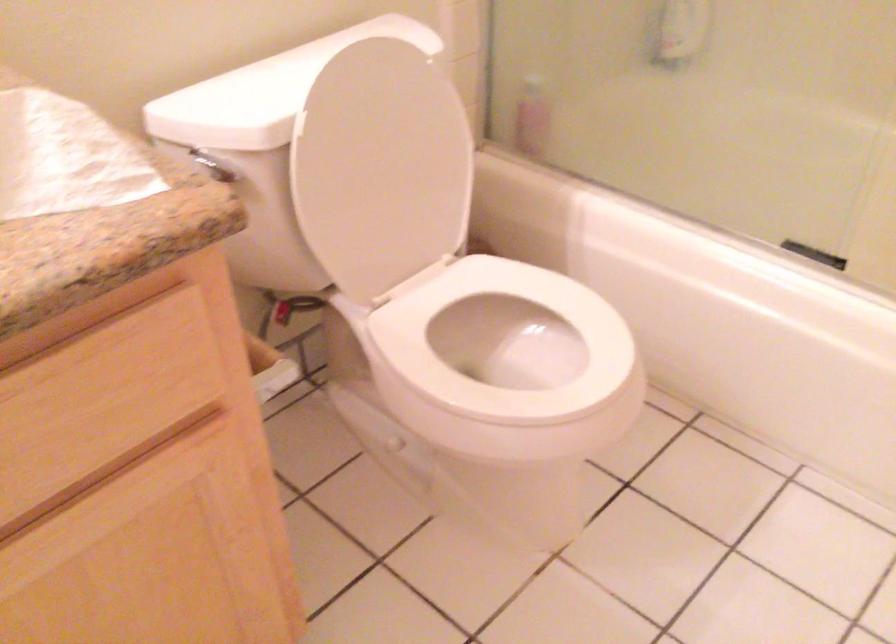
What do you see at coordinates (381, 167) in the screenshot? I see `the white toilet lid` at bounding box center [381, 167].